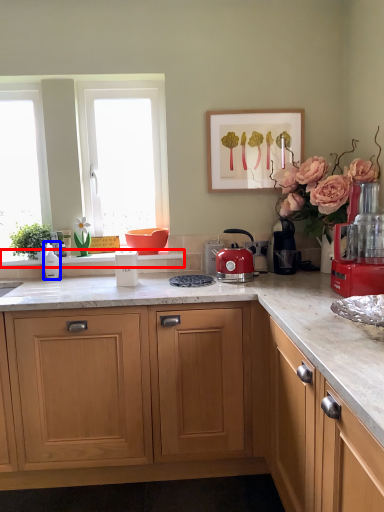
Question: Which object is closer to the camera taking this photo, window sill (highlighted by a red box) or kitchen appliance (highlighted by a blue box)?

Choices:
 (A) window sill
 (B) kitchen appliance

Answer: (B)